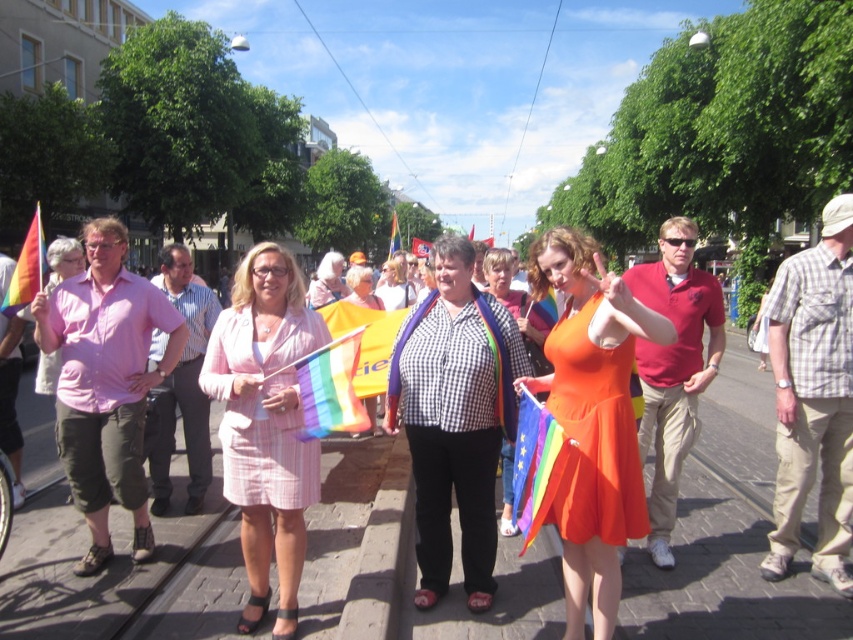
Looking at this image, you are a photographer positioned at the edge of the street, aiming to capture a photo that includes both the pink checkered suit at center and the orange cotton dress at center. Given that your camera has a maximum focus range of 4 meters, will you be able to include both subjects in a single frame without moving your position?

The pink checkered suit at center is 4.25 meters away from the orange cotton dress at center. Since the distance between them exceeds the camera maximum focus range of 4 meters, you cannot capture both subjects in a single frame without moving your position.

Looking at this image, you are a photographer trying to capture a shot of the orange satin dress at center and the pink checkered suit at center. Since you want to focus on the dress first, which one should you adjust your camera to prioritize in terms of depth of field?

The orange satin dress at center is located above the pink checkered suit at center, so adjusting the camera to prioritize the dress in the foreground would ensure it is in focus first.

You are a photographer trying to capture a photo of both the orange satin dress at center and the orange cotton dress at center. Since you want to ensure both dresses are fully visible in the frame, which dress should you focus on first to avoid cropping any part of it?

The orange satin dress at center is much taller than the orange cotton dress at center, so you should focus on positioning the camera to include the taller orange satin dress at center first to ensure it fits entirely within the frame.